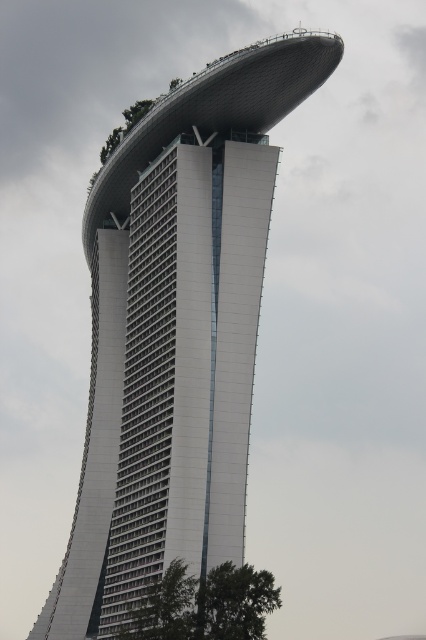
You are an architect evaluating the scale of the white glass tower at center and the green leafy tree at lower right. Which object is larger in size?

The white glass tower at center is bigger than the green leafy tree at lower right according to the description.

You are standing at the base of the white glass tower at center and want to plant a new tree in the garden behind it. Is the green leafy tree at lower right already blocking the area where you want to plant?

The white glass tower at center is positioned over the green leafy tree at lower right, meaning the tree is directly beneath the tower. Since the tower is above, you can plant the new tree in the garden area behind the existing tree without obstruction.

You are standing at the base of the skyscraper and want to take a photo of the rooftop garden. There are two points marked on your map at coordinates point (141, 435) and point (224, 627). Which point should you stand at to ensure the rooftop garden is fully visible without obstruction?

You should stand at point (224, 627) because point (141, 435) is behind it, meaning the rooftop garden might be obstructed from the other point.